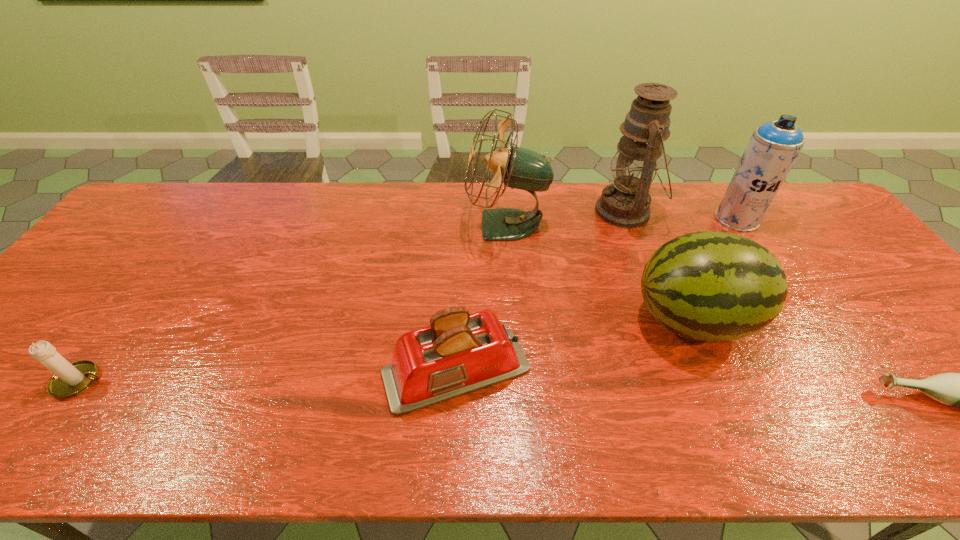
I want to click on oil lamp, so click(625, 203).

You are a GUI agent. You are given a task and a screenshot of the screen. Output one action in this format:
    pyautogui.click(x=<x>, y=<y>)
    Task: Click on the fan
    
    Given the screenshot: What is the action you would take?
    pyautogui.click(x=521, y=168)

Image resolution: width=960 pixels, height=540 pixels. I want to click on aerosol can, so click(774, 146).

In order to click on watermelon in this screenshot , I will do `click(709, 286)`.

Identify the location of the fifth tallest object. (459, 352).

Where is `candle holder`? The image size is (960, 540). candle holder is located at coordinates (69, 380).

Find the location of a particular element. The height and width of the screenshot is (540, 960). the leftmost object is located at coordinates (69, 380).

At what (x,y) coordinates should I click in order to perform the action: click on vacant space located on the left of the oil lamp. Please return your answer as a coordinate pair (x, y). Looking at the image, I should click on (484, 211).

Where is `vacant area located 0.230m on the front-facing side of the fan for air flow`? The width and height of the screenshot is (960, 540). vacant area located 0.230m on the front-facing side of the fan for air flow is located at coordinates (392, 226).

You are a GUI agent. You are given a task and a screenshot of the screen. Output one action in this format:
    pyautogui.click(x=<x>, y=<y>)
    Task: Click on the vacant space located 0.070m on the front-facing side of the fan for air flow
    
    Given the screenshot: What is the action you would take?
    pyautogui.click(x=444, y=226)